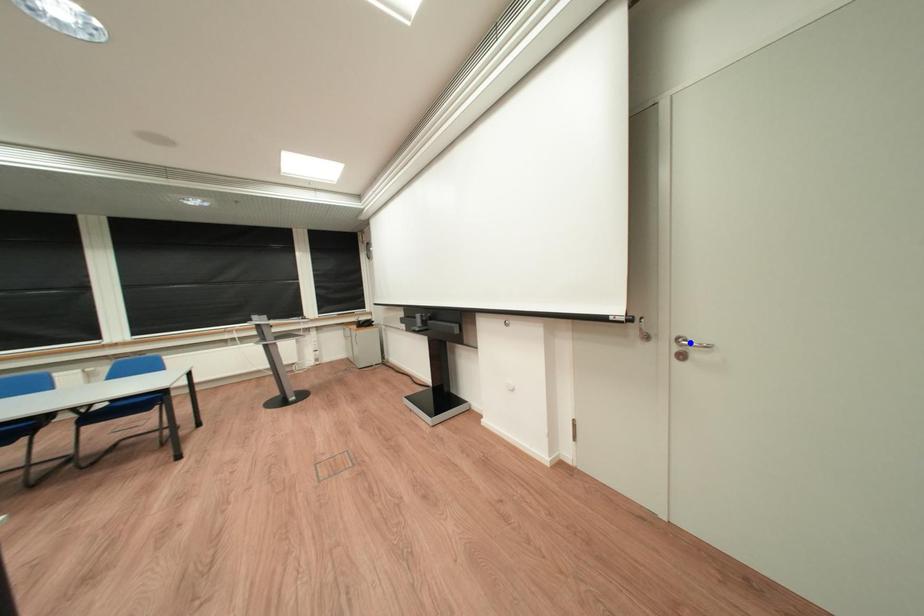
Question: In the image, two points are highlighted. Which point is nearer to the camera? Reply with the corresponding letter.

Choices:
 (A) blue point
 (B) red point

Answer: (B)